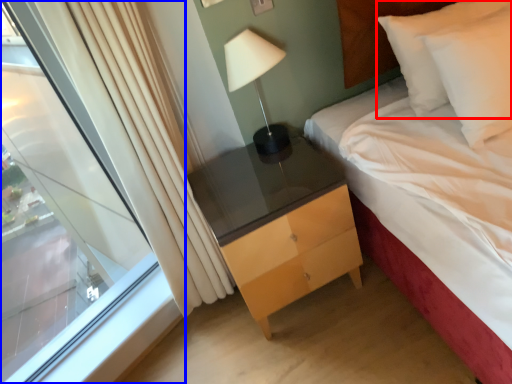
Question: Which point is further to the camera, pillow (highlighted by a red box) or window (highlighted by a blue box)?

Choices:
 (A) pillow
 (B) window

Answer: (A)